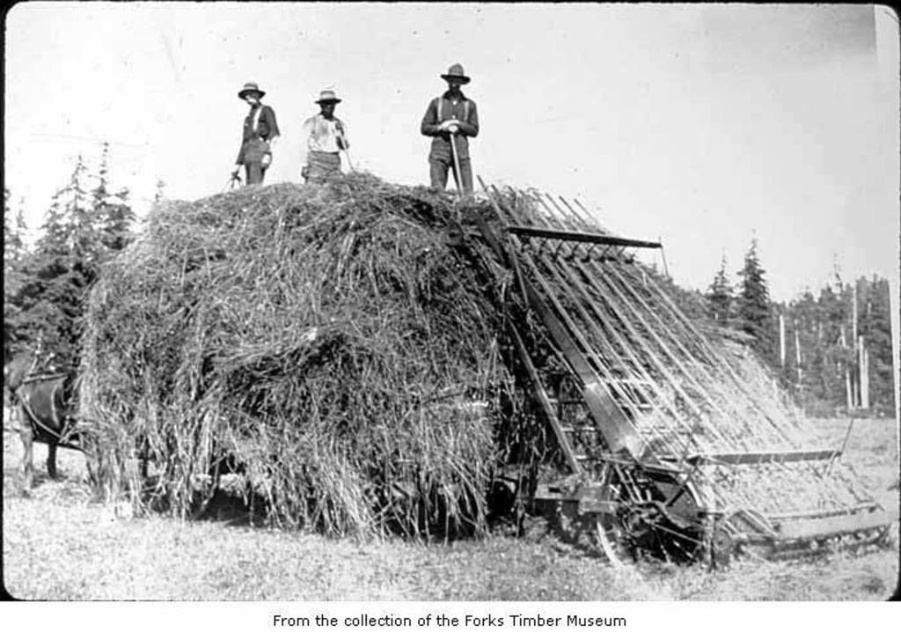
You are a photographer analyzing the composition of this historical black and white image. You notice two objects at the upper center of the hay stack. Which object is located to the left when viewed from the photographer perspective? The rugged brown leather hat at upper center or the smooth wooden stick at upper center?

The rugged brown leather hat at upper center is positioned on the left side of smooth wooden stick at upper center, so the rugged brown leather hat at upper center is located to the left.